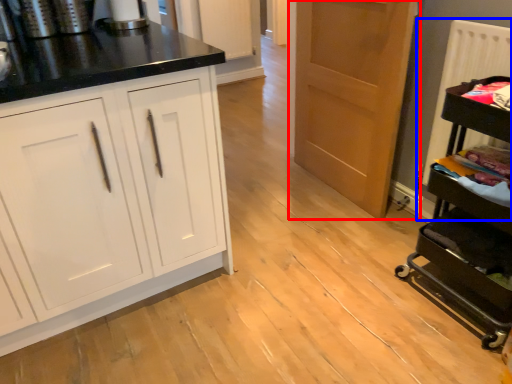
Question: Which point is further to the camera, door (highlighted by a red box) or radiator (highlighted by a blue box)?

Choices:
 (A) door
 (B) radiator

Answer: (A)